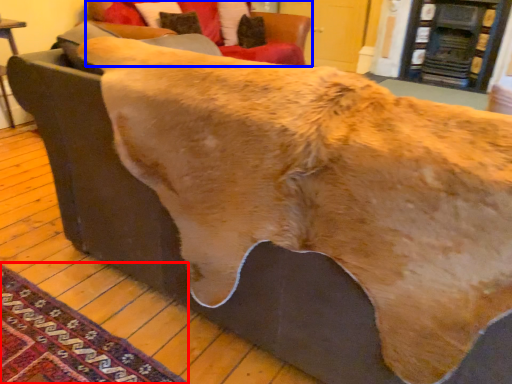
Question: Which point is closer to the camera, mat (highlighted by a red box) or studio couch (highlighted by a blue box)?

Choices:
 (A) mat
 (B) studio couch

Answer: (A)